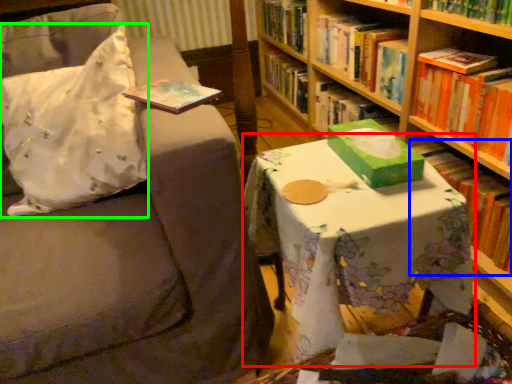
Question: Considering the real-world distances, which object is closest to table (highlighted by a red box)? book (highlighted by a blue box) or throw pillow (highlighted by a green box).

Choices:
 (A) book
 (B) throw pillow

Answer: (B)